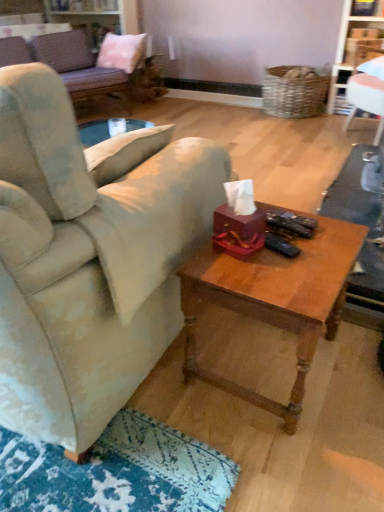
Question: Does point (8, 96) appear closer or farther from the camera than point (127, 51)?

Choices:
 (A) farther
 (B) closer

Answer: (B)

Question: Considering the positions of velvet beige couch at center, which is counted as the first studio couch, starting from the front, and pink fabric pillow at upper left in the image, is velvet beige couch at center, which is counted as the first studio couch, starting from the front, bigger or smaller than pink fabric pillow at upper left?

Choices:
 (A) big
 (B) small

Answer: (A)

Question: Estimate the real-world distances between objects in this image. Which object is closer to the velvet purple studio couch at upper left, arranged as the second studio couch when ordered from the bottom?

Choices:
 (A) velvet beige couch at center, positioned as the 2th studio couch in back-to-front order
 (B) white glossy bookshelf at upper right
 (C) wooden coffee table at center
 (D) pink fabric pillow at upper left

Answer: (D)

Question: Estimate the real-world distances between objects in this image. Which object is closer to the pink fabric pillow at upper left?

Choices:
 (A) velvet purple studio couch at upper left, acting as the first studio couch starting from the back
 (B) wooden coffee table at center
 (C) white glossy bookshelf at upper right
 (D) velvet beige couch at center, the second studio couch when ordered from top to bottom

Answer: (A)